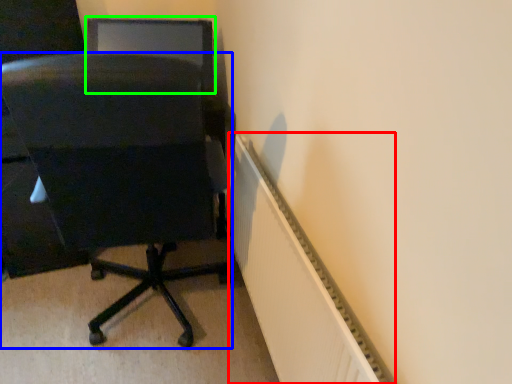
Question: Which is farther away from radiator (highlighted by a red box)? chair (highlighted by a blue box) or computer monitor (highlighted by a green box)?

Choices:
 (A) chair
 (B) computer monitor

Answer: (B)